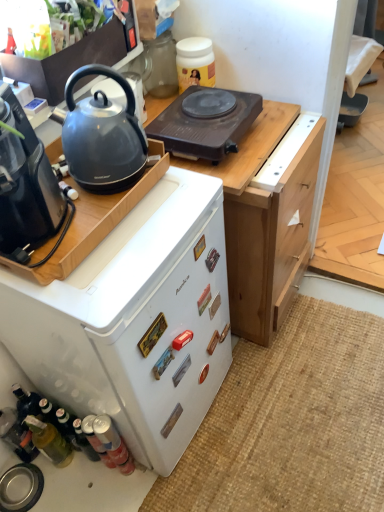
Where is `blank space situated above burlap mat at lower right (from a real-world perspective)`? The image size is (384, 512). blank space situated above burlap mat at lower right (from a real-world perspective) is located at coordinates (302, 404).